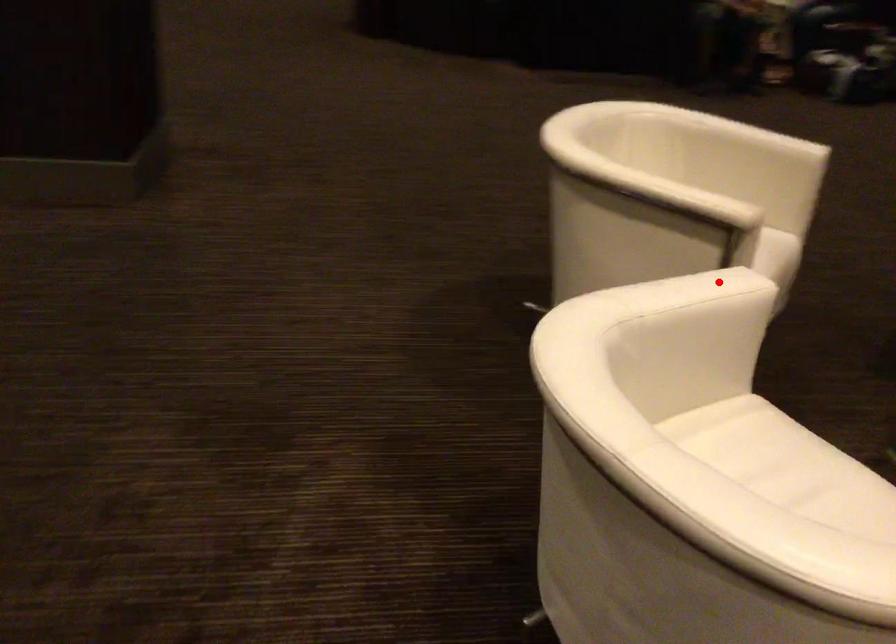
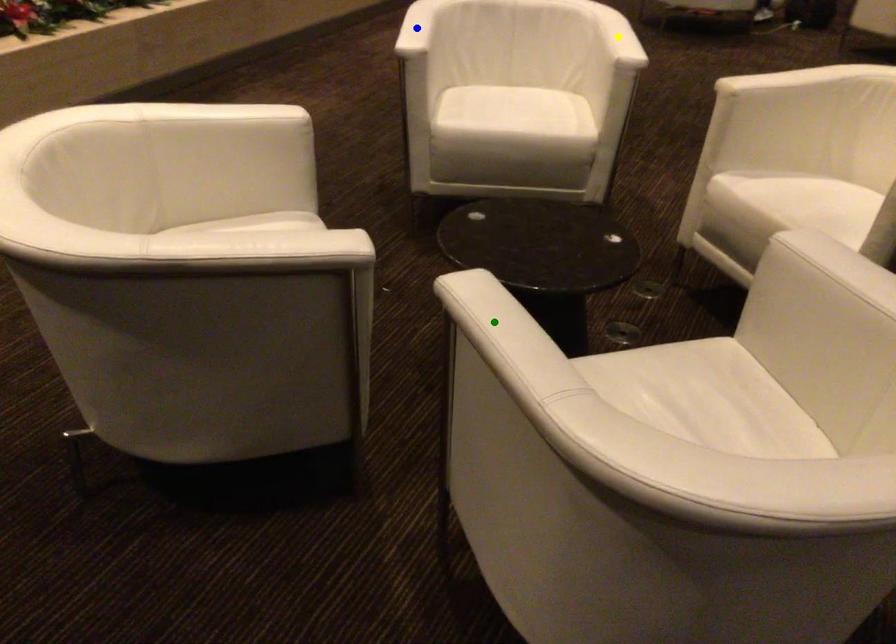
Question: I am providing you with two images of the same scene from different viewpoints. A red point is marked on the first image. You are given multiple points on the second image. Can you choose the point in image 2 that corresponds to the point in image 1?

Choices:
 (A) green point
 (B) yellow point
 (C) blue point

Answer: (B)